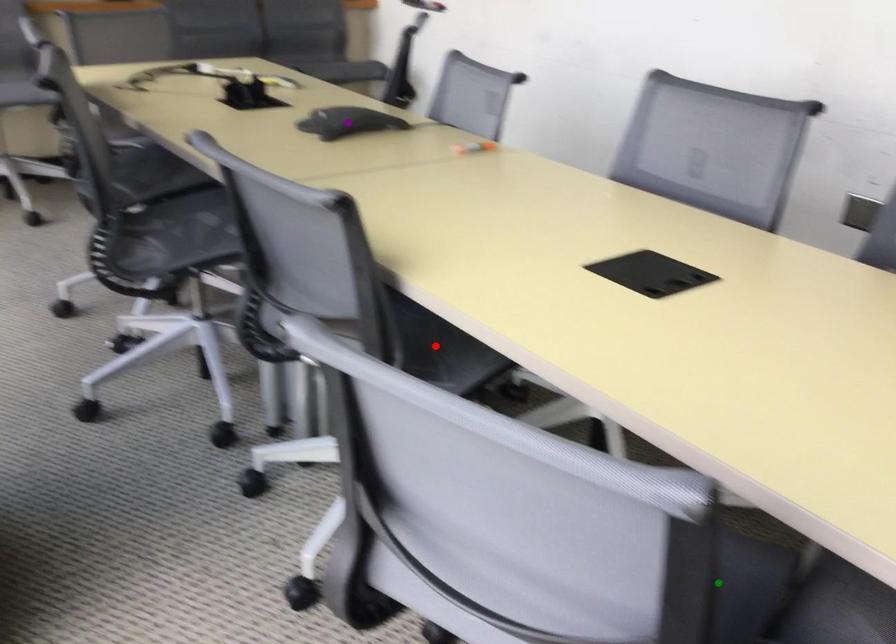
Order these from nearest to farthest:
green point
purple point
red point

purple point < red point < green point